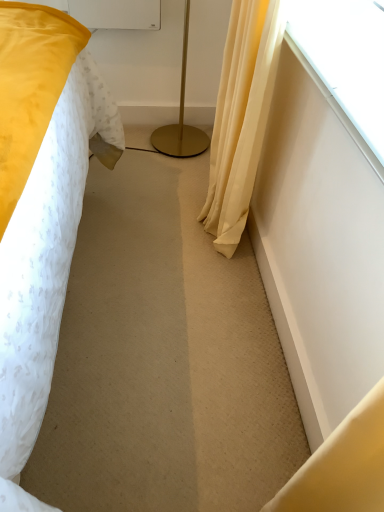
Question: Considering the relative sizes of gold metallic floor lamp at center and silky yellow curtain at right in the image provided, is gold metallic floor lamp at center smaller than silky yellow curtain at right?

Choices:
 (A) no
 (B) yes

Answer: (B)

Question: Does gold metallic floor lamp at center appear on the right side of silky yellow curtain at right?

Choices:
 (A) no
 (B) yes

Answer: (A)

Question: From a real-world perspective, is gold metallic floor lamp at center located beneath silky yellow curtain at right?

Choices:
 (A) no
 (B) yes

Answer: (B)

Question: Does gold metallic floor lamp at center have a greater height compared to silky yellow curtain at right?

Choices:
 (A) yes
 (B) no

Answer: (B)

Question: Is gold metallic floor lamp at center wider than silky yellow curtain at right?

Choices:
 (A) no
 (B) yes

Answer: (B)

Question: Is point (251, 139) positioned closer to the camera than point (345, 35)?

Choices:
 (A) closer
 (B) farther

Answer: (B)

Question: From a real-world perspective, is silky yellow curtain at right above or below transparent glass window at upper right?

Choices:
 (A) below
 (B) above

Answer: (A)

Question: Is silky yellow curtain at right in front of or behind transparent glass window at upper right in the image?

Choices:
 (A) behind
 (B) front

Answer: (A)

Question: Considering the relative positions of silky yellow curtain at right and transparent glass window at upper right in the image provided, is silky yellow curtain at right to the left or to the right of transparent glass window at upper right?

Choices:
 (A) left
 (B) right

Answer: (A)

Question: In terms of height, does gold metallic floor lamp at center look taller or shorter compared to silky yellow curtain at right?

Choices:
 (A) short
 (B) tall

Answer: (A)

Question: Which is correct: gold metallic floor lamp at center is inside silky yellow curtain at right, or outside of it?

Choices:
 (A) outside
 (B) inside

Answer: (A)

Question: Is point (188, 147) positioned closer to the camera than point (243, 145)?

Choices:
 (A) closer
 (B) farther

Answer: (B)

Question: In terms of size, does gold metallic floor lamp at center appear bigger or smaller than silky yellow curtain at right?

Choices:
 (A) small
 (B) big

Answer: (A)

Question: Is point (375, 50) positioned closer to the camera than point (230, 225)?

Choices:
 (A) farther
 (B) closer

Answer: (B)

Question: Is transparent glass window at upper right wider or thinner than silky yellow curtain at right?

Choices:
 (A) wide
 (B) thin

Answer: (B)